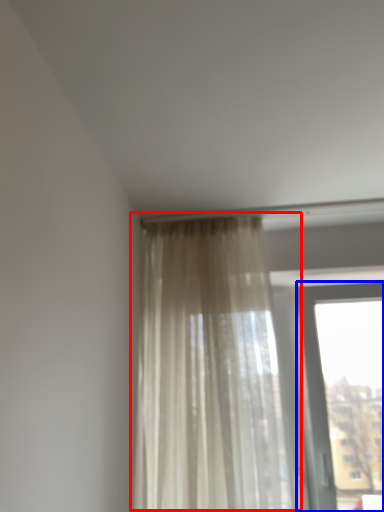
Question: Which of the following is the closest to the observer, curtain (highlighted by a red box) or window (highlighted by a blue box)?

Choices:
 (A) curtain
 (B) window

Answer: (A)